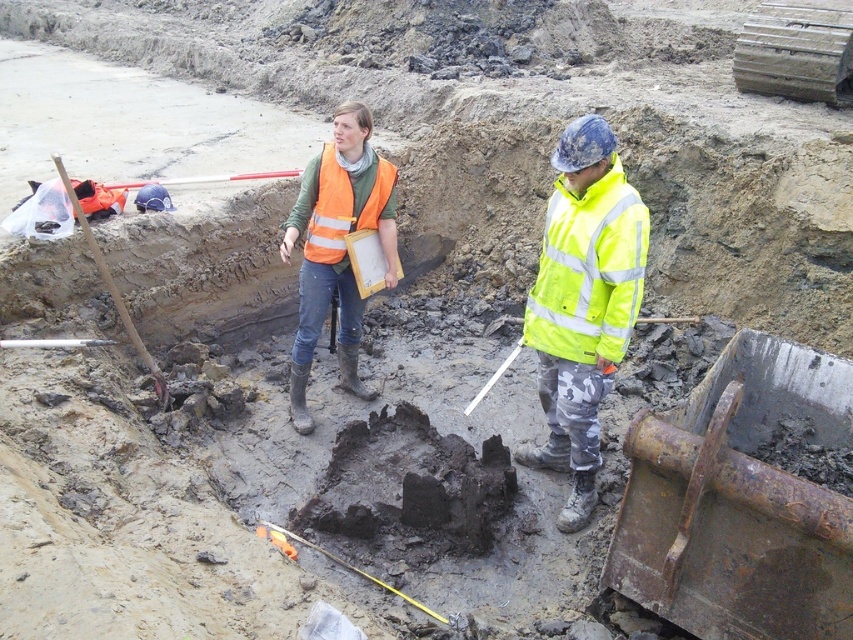
Question: Can you confirm if yellow reflective jacket at right is positioned below high-visibility orange safety vest at center?

Choices:
 (A) no
 (B) yes

Answer: (B)

Question: Estimate the real-world distances between objects in this image. Which object is closer to the yellow reflective jacket at right?

Choices:
 (A) reflective orange vest at center
 (B) high-visibility orange safety vest at center

Answer: (A)

Question: Which of these objects is positioned closest to the reflective orange vest at center?

Choices:
 (A) wooden shovel at left
 (B) yellow reflective jacket at right

Answer: (A)

Question: Which point appears closest to the camera in this image?

Choices:
 (A) (553, 289)
 (B) (340, 172)
 (C) (308, 252)
 (D) (157, 381)

Answer: (A)

Question: Is high-visibility orange safety vest at center further to camera compared to wooden shovel at left?

Choices:
 (A) yes
 (B) no

Answer: (A)

Question: Can you confirm if reflective orange vest at center is bigger than wooden shovel at left?

Choices:
 (A) yes
 (B) no

Answer: (B)